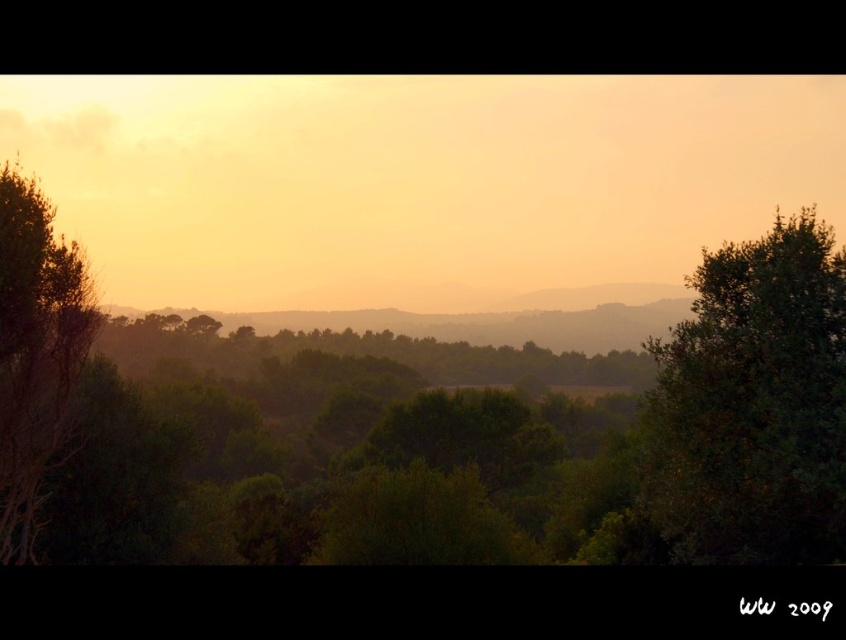
Question: Can you confirm if green leafy tree at right is wider than green leafy tree at left?

Choices:
 (A) yes
 (B) no

Answer: (A)

Question: Among these objects, which one is farthest from the camera?

Choices:
 (A) green leafy tree at left
 (B) green leafy tree at right

Answer: (A)

Question: Does green leafy tree at right appear on the right side of green leafy tree at left?

Choices:
 (A) no
 (B) yes

Answer: (B)

Question: Which of the following is the closest to the observer?

Choices:
 (A) (14, 381)
 (B) (775, 332)

Answer: (B)

Question: Among these points, which one is nearest to the camera?

Choices:
 (A) (14, 451)
 (B) (700, 552)

Answer: (B)

Question: Can you confirm if green leafy tree at right is positioned below green leafy tree at left?

Choices:
 (A) yes
 (B) no

Answer: (A)